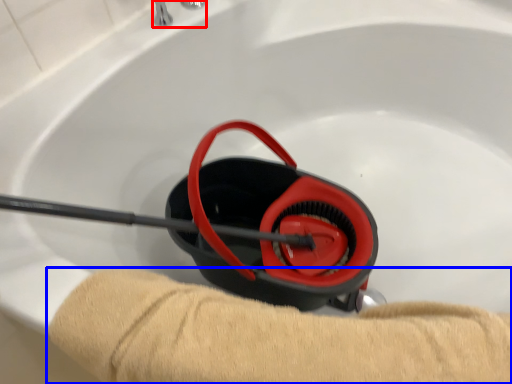
Question: Which object appears closest to the camera in this image, faucet (highlighted by a red box) or tan (highlighted by a blue box)?

Choices:
 (A) faucet
 (B) tan

Answer: (B)